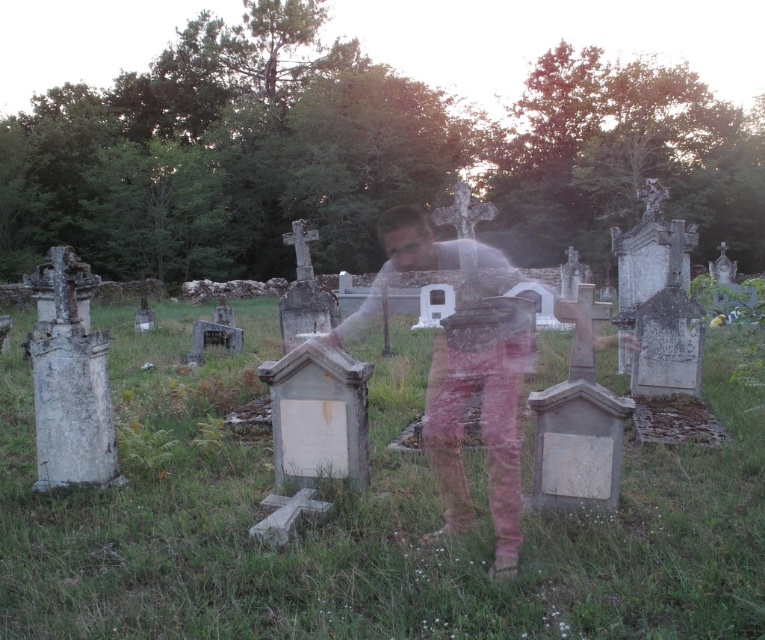
You are standing at the center of the cemetery and want to place a new tombstone exactly where the white stone tombstones at center are located. What are the coordinates of that location?

The coordinates for the white stone tombstones at center are at point (360, 522).

You are a photographer planning to take a picture of the white stone tombstones at center and the pink cotton pants at center in the cemetery. Which object is wider?

The white stone tombstones at center is wider than the pink cotton pants at center because the white stone tombstones at center surpass the pink cotton pants at center in width.